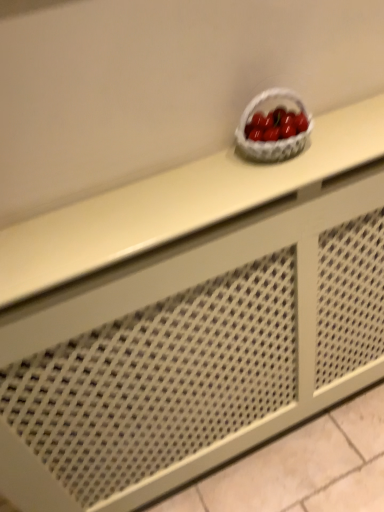
Image resolution: width=384 pixels, height=512 pixels. I want to click on free space in front of white textured basket at upper center, so coord(277,182).